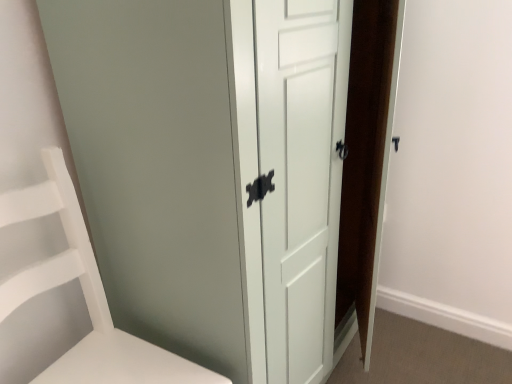
Question: Does white matte shelf at left have a greater width compared to white glossy door at center?

Choices:
 (A) yes
 (B) no

Answer: (B)

Question: Is white matte shelf at left turned away from white glossy door at center?

Choices:
 (A) yes
 (B) no

Answer: (B)

Question: Is white matte shelf at left at the left side of white glossy door at center?

Choices:
 (A) yes
 (B) no

Answer: (A)

Question: Does white matte shelf at left have a lesser height compared to white glossy door at center?

Choices:
 (A) yes
 (B) no

Answer: (A)

Question: Considering the relative positions of white matte shelf at left and white glossy door at center in the image provided, is white matte shelf at left in front of white glossy door at center?

Choices:
 (A) yes
 (B) no

Answer: (A)

Question: From the image's perspective, is white matte shelf at left over white glossy door at center?

Choices:
 (A) no
 (B) yes

Answer: (A)

Question: Can you confirm if white glossy door at center is taller than white matte shelf at left?

Choices:
 (A) yes
 (B) no

Answer: (A)

Question: Is white glossy door at center completely or partially outside of white matte shelf at left?

Choices:
 (A) yes
 (B) no

Answer: (A)

Question: Does white glossy door at center have a greater width compared to white matte shelf at left?

Choices:
 (A) yes
 (B) no

Answer: (A)

Question: Does white glossy door at center come behind white matte shelf at left?

Choices:
 (A) yes
 (B) no

Answer: (A)

Question: Considering the relative positions of white glossy door at center and white matte shelf at left in the image provided, is white glossy door at center in front of white matte shelf at left?

Choices:
 (A) yes
 (B) no

Answer: (B)

Question: Can you confirm if white glossy door at center is thinner than white matte shelf at left?

Choices:
 (A) yes
 (B) no

Answer: (B)

Question: Does point (144, 345) appear closer or farther from the camera than point (244, 332)?

Choices:
 (A) closer
 (B) farther

Answer: (B)